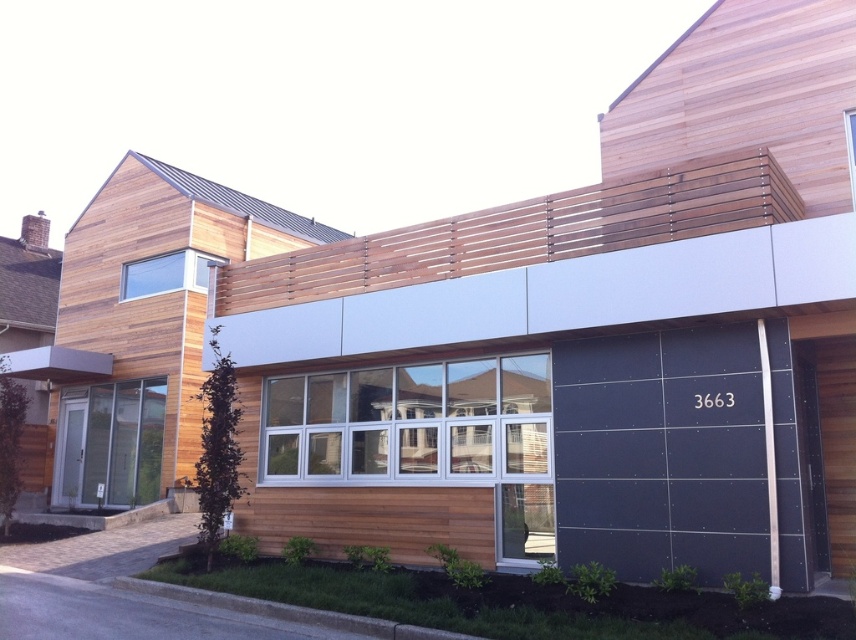
Is dark gray matte/glossy garage door at lower right positioned behind matte gray glass door at lower left?

That is False.

Between dark gray matte/glossy garage door at lower right and matte gray glass door at lower left, which one is positioned higher?

dark gray matte/glossy garage door at lower right is above.

Between point (726, 493) and point (122, 445), which one is positioned in front?

Point (726, 493) is more forward.

The height and width of the screenshot is (640, 856). I want to click on dark gray matte/glossy garage door at lower right, so click(663, 452).